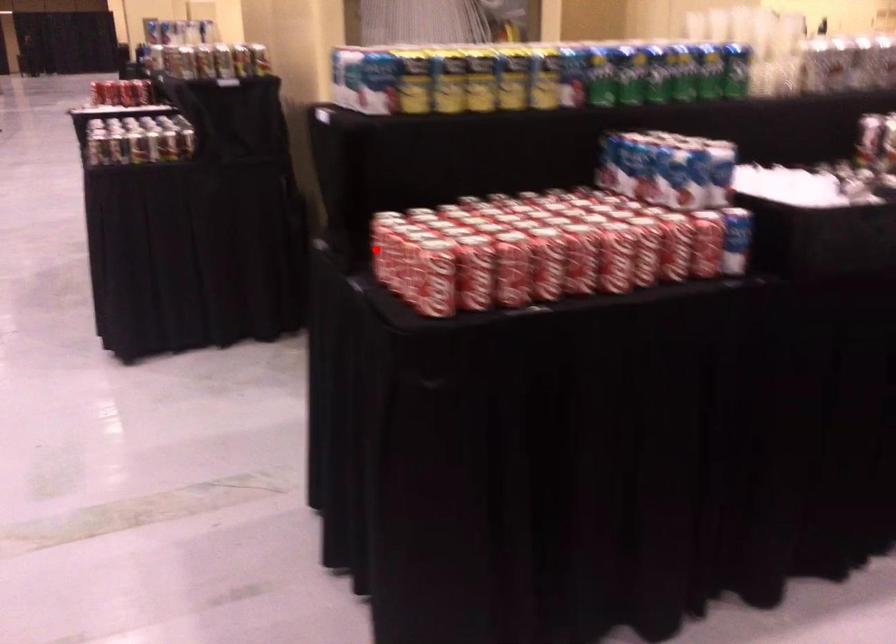
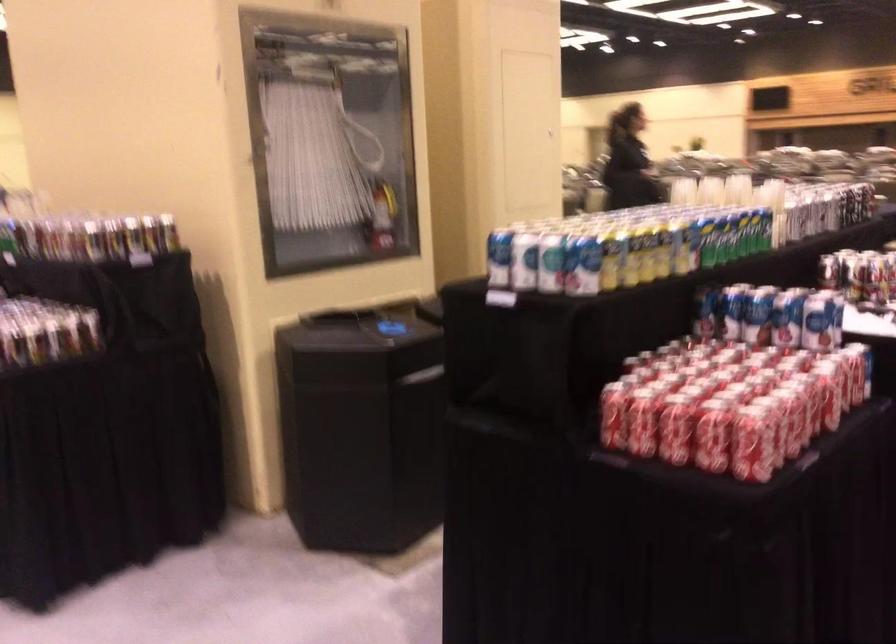
Question: I am providing you with two images of the same scene from different viewpoints. In image1, a red point is highlighted. Considering the same 3D point in image2, which of the following is correct?

Choices:
 (A) It is closer
 (B) It is farther

Answer: (A)